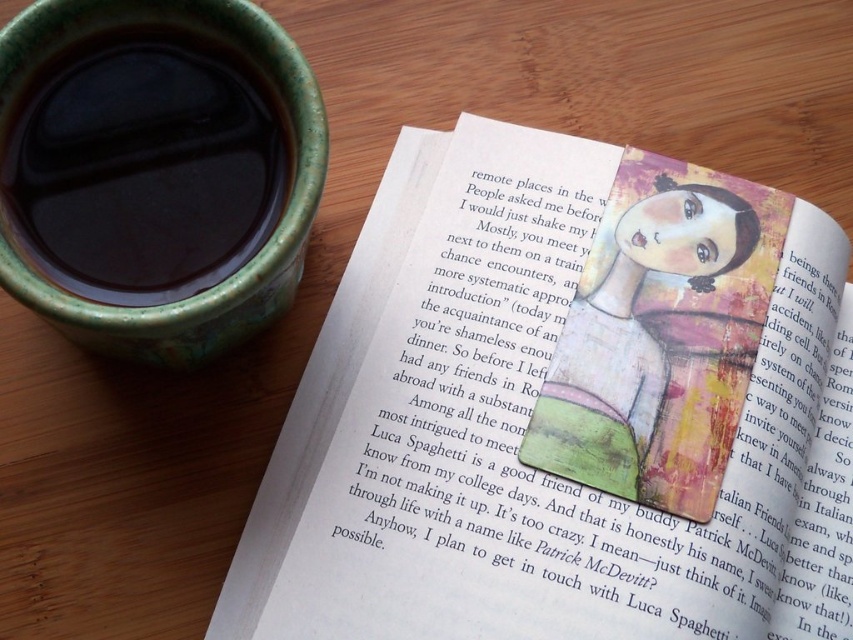
You are a barista who needs to place a 12 inch long tray between the matte green cup at upper left and the matte painted doll at center. Will the tray fit between them?

The distance between the matte green cup at upper left and the matte painted doll at center is 13.76 inches, so the 12 inch long tray will fit between them since it is shorter than the available space.

You are an assistant who needs to place a new sticker on the book page. The sticker must be placed exactly at the coordinates where the matte paper bookmark at center is located. What are the coordinates where you should place the sticker?

The coordinates for the matte paper bookmark at center are at point (564, 410), so you should place the sticker at those coordinates.

You are organizing a small display and need to place both the matte paper bookmark at center and the matte painted doll at center on a shelf. The shelf has a width limit of 12 cm. If the combined width of both items must not exceed this limit, can you determine if they can fit together?

The matte paper bookmark at center is wider than the matte painted doll at center. However, without knowing their exact widths, it is impossible to determine if their combined width exceeds 12 cm. Additional measurements are needed.